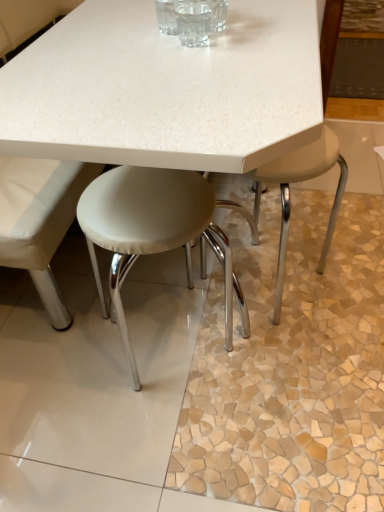
You are a GUI agent. You are given a task and a screenshot of the screen. Output one action in this format:
    pyautogui.click(x=<x>, y=<y>)
    Task: Click on the free space in front of beige leather stool at lower right, arranged as the first stool when viewed from the right
    The width and height of the screenshot is (384, 512).
    Given the screenshot: What is the action you would take?
    pyautogui.click(x=302, y=392)